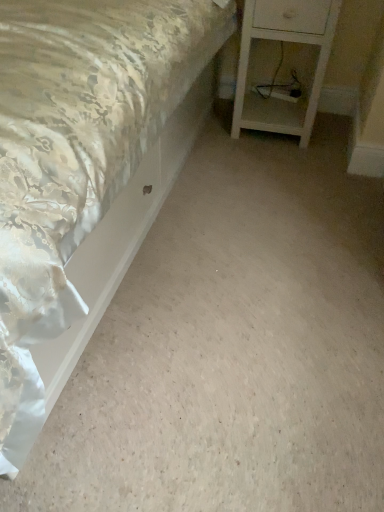
What do you see at coordinates (76, 155) in the screenshot? I see `silky satin bed at upper left` at bounding box center [76, 155].

Where is `silky satin bed at upper left`? Image resolution: width=384 pixels, height=512 pixels. silky satin bed at upper left is located at coordinates (76, 155).

The width and height of the screenshot is (384, 512). Identify the location of white wood nightstand at lower right. (283, 41).

What do you see at coordinates (283, 41) in the screenshot? This screenshot has width=384, height=512. I see `white wood nightstand at lower right` at bounding box center [283, 41].

Find the location of `silky satin bed at upper left`. silky satin bed at upper left is located at coordinates (76, 155).

Considering the positions of objects white wood nightstand at lower right and silky satin bed at upper left in the image provided, who is more to the right, white wood nightstand at lower right or silky satin bed at upper left?

Positioned to the right is white wood nightstand at lower right.

Which is in front, white wood nightstand at lower right or silky satin bed at upper left?

silky satin bed at upper left is closer to the camera.

Considering the points (246, 49) and (166, 115), which point is in front, point (246, 49) or point (166, 115)?

The point (166, 115) is closer.

From the image's perspective, is white wood nightstand at lower right located above silky satin bed at upper left?

Yes, from the image's perspective, white wood nightstand at lower right is on top of silky satin bed at upper left.

From a real-world perspective, is white wood nightstand at lower right beneath silky satin bed at upper left?

No, from a real-world perspective, white wood nightstand at lower right is not under silky satin bed at upper left.

Considering the relative sizes of white wood nightstand at lower right and silky satin bed at upper left in the image provided, is white wood nightstand at lower right wider than silky satin bed at upper left?

In fact, white wood nightstand at lower right might be narrower than silky satin bed at upper left.

Considering the relative sizes of white wood nightstand at lower right and silky satin bed at upper left in the image provided, is white wood nightstand at lower right taller than silky satin bed at upper left?

Yes.

Considering the sizes of objects white wood nightstand at lower right and silky satin bed at upper left in the image provided, who is smaller, white wood nightstand at lower right or silky satin bed at upper left?

white wood nightstand at lower right.

Can we say white wood nightstand at lower right lies outside silky satin bed at upper left?

Yes.

Is there a large distance between white wood nightstand at lower right and silky satin bed at upper left?

They are positioned close to each other.

Is white wood nightstand at lower right looking in the opposite direction of silky satin bed at upper left?

That's not correct — white wood nightstand at lower right is not looking away from silky satin bed at upper left.

Can you tell me how much white wood nightstand at lower right and silky satin bed at upper left differ in facing direction?

90 degrees.

What are the coordinates of `bed to the left of white wood nightstand at lower right` in the screenshot? It's located at (76, 155).

Can you confirm if silky satin bed at upper left is positioned to the right of white wood nightstand at lower right?

In fact, silky satin bed at upper left is to the left of white wood nightstand at lower right.

Is the position of silky satin bed at upper left less distant than that of white wood nightstand at lower right?

Yes, the depth of silky satin bed at upper left is less than that of white wood nightstand at lower right.

Between point (34, 388) and point (235, 103), which one is positioned in front?

The point (34, 388) is closer to the camera.

Consider the image. From the image's perspective, would you say silky satin bed at upper left is positioned over white wood nightstand at lower right?

No.

From a real-world perspective, is silky satin bed at upper left positioned above or below white wood nightstand at lower right?

From a real-world perspective, silky satin bed at upper left is physically below white wood nightstand at lower right.

In the scene shown: Which object is wider, silky satin bed at upper left or white wood nightstand at lower right?

With larger width is silky satin bed at upper left.

Can you confirm if silky satin bed at upper left is taller than white wood nightstand at lower right?

In fact, silky satin bed at upper left may be shorter than white wood nightstand at lower right.

Does silky satin bed at upper left have a smaller size compared to white wood nightstand at lower right?

No, silky satin bed at upper left is not smaller than white wood nightstand at lower right.

Is white wood nightstand at lower right inside silky satin bed at upper left?

No, white wood nightstand at lower right is not a part of silky satin bed at upper left.

Is silky satin bed at upper left placed right next to white wood nightstand at lower right?

Answer: No, silky satin bed at upper left is not in contact with white wood nightstand at lower right.

Is silky satin bed at upper left looking in the opposite direction of white wood nightstand at lower right?

That's not correct — silky satin bed at upper left is not looking away from white wood nightstand at lower right.

What's the angular difference between silky satin bed at upper left and white wood nightstand at lower right's facing directions?

silky satin bed at upper left and white wood nightstand at lower right are facing 90 degrees away from each other.

You are a GUI agent. You are given a task and a screenshot of the screen. Output one action in this format:
    pyautogui.click(x=<x>, y=<y>)
    Task: Click on the bed on the left of white wood nightstand at lower right
    The height and width of the screenshot is (512, 384).
    Given the screenshot: What is the action you would take?
    pyautogui.click(x=76, y=155)

Where is `nightstand lying behind the silky satin bed at upper left`? nightstand lying behind the silky satin bed at upper left is located at coordinates (283, 41).

Find the location of a particular element. bed on the left of the white wood nightstand at lower right is located at coordinates (76, 155).